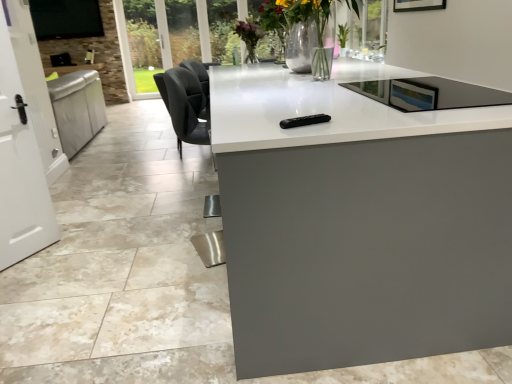
Locate an element on the screen. The image size is (512, 384). free area behind white glossy door at left is located at coordinates (75, 229).